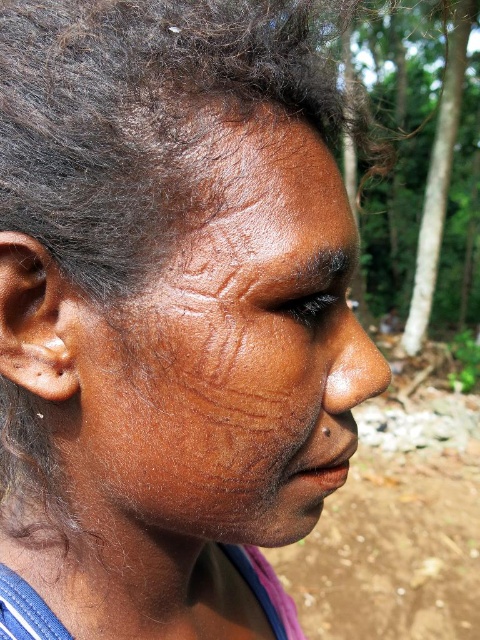
You are a photographer adjusting your camera focus. You want to capture both the dry skin at upper center and the green leafy tree at upper right in sharp focus. Which object should you focus on first to ensure both are in focus?

You should focus on the dry skin at upper center first because it is closer to the viewer than the green leafy tree at upper right. By focusing on the closer object, the depth of field may extend to include the background tree in focus as well.

You are a photographer trying to capture a portrait of the person in the scene. You notice the dry skin at upper center and the green leafy tree at upper right in the background. Which object is shorter in height?

The dry skin at upper center has a lesser height compared to the green leafy tree at upper right, so the dry skin at upper center is shorter in height.

Based on the photo, you are a photographer adjusting your focus on a camera. You notice two points in the scene labeled as point [307,188] and point [349,77]. Which point should you focus on to ensure it appears sharp in the final photo if you want the closest object to the camera to be in focus?

You should focus on point [307,188] because it is closer to the camera than point [349,77], so it will appear sharp when in focus.